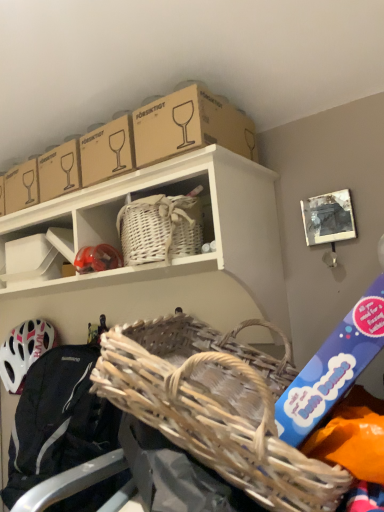
Image resolution: width=384 pixels, height=512 pixels. Describe the element at coordinates (58, 420) in the screenshot. I see `woven fabric basket at lower left` at that location.

Describe the element at coordinates (214, 408) in the screenshot. I see `woven natural picnic basket at center` at that location.

What is the approximate width of white matte helmet at lower left?

The width of white matte helmet at lower left is 16.85 centimeters.

Identify the location of white plastic tray at lower left. (38, 252).

Find the location of a particular element. Image resolution: width=384 pixels, height=512 pixels. woven fabric basket at lower left is located at coordinates (58, 420).

Consider the image. Which is closer, (199, 140) or (47, 346)?

Point (199, 140) is positioned closer to the camera compared to point (47, 346).

Who is more distant, brown cardboard box at upper center or white matte helmet at lower left?

white matte helmet at lower left is behind.

From the image's perspective, is brown cardboard box at upper center located beneath white matte helmet at lower left?

No, from the image's perspective, brown cardboard box at upper center is not beneath white matte helmet at lower left.

Which is more to the left, white matte helmet at lower left or white plastic tray at lower left?

white matte helmet at lower left.

Can you confirm if white matte helmet at lower left is bigger than white plastic tray at lower left?

Indeed, white matte helmet at lower left has a larger size compared to white plastic tray at lower left.

Is white matte helmet at lower left behind white plastic tray at lower left?

Yes, the depth of white matte helmet at lower left is greater than that of white plastic tray at lower left.

Is point (8, 386) less distant than point (16, 268)?

No, (8, 386) is further to viewer.

Does woven fabric basket at lower left appear on the left side of white wicker basket at upper center?

No, woven fabric basket at lower left is not to the left of white wicker basket at upper center.

The height and width of the screenshot is (512, 384). In order to click on clothing located below the white wicker basket at upper center (from the image's perspective) in this screenshot , I will do `click(58, 420)`.

Is woven fabric basket at lower left next to white wicker basket at upper center and touching it?

No.

Which is behind, point (57, 350) or point (51, 269)?

Point (57, 350)

Is matte red helmet at center at the right side of white matte helmet at lower left?

Yes.

Image resolution: width=384 pixels, height=512 pixels. What are the coordinates of `helmet that appears behind the matte red helmet at center` in the screenshot? It's located at (24, 351).

How many degrees apart are the facing directions of matte red helmet at center and white matte helmet at lower left?

matte red helmet at center and white matte helmet at lower left are facing 1.58 degrees away from each other.

The width and height of the screenshot is (384, 512). Identify the location of storage box located above the white matte helmet at lower left (from a real-world perspective). (190, 126).

Who is taller, white matte helmet at lower left or brown cardboard box at upper center?

white matte helmet at lower left is taller.

From a real-world perspective, which object rests below the other?

white matte helmet at lower left, from a real-world perspective.

From the image's perspective, is white matte helmet at lower left below brown cardboard box at upper center?

Yes.

Which of these two, brown cardboard box at upper center or woven natural picnic basket at center, is bigger?

With larger size is woven natural picnic basket at center.

Does brown cardboard box at upper center have a greater height compared to woven natural picnic basket at center?

No, brown cardboard box at upper center is not taller than woven natural picnic basket at center.

Is woven natural picnic basket at center completely or partially inside brown cardboard box at upper center?

No, woven natural picnic basket at center is not surrounded by brown cardboard box at upper center.

Would you say matte red helmet at center is to the left or to the right of white plastic tray at lower left in the picture?

From the image, it's evident that matte red helmet at center is to the right of white plastic tray at lower left.

Is point (95, 266) closer to camera compared to point (34, 241)?

Yes, point (95, 266) is closer to viewer.

You are a GUI agent. You are given a task and a screenshot of the screen. Output one action in this format:
    pyautogui.click(x=<x>, y=<y>)
    Task: Click on the helmet below the brown cardboard box at upper center (from the image's perspective)
    The width and height of the screenshot is (384, 512).
    Given the screenshot: What is the action you would take?
    pyautogui.click(x=24, y=351)

What are the coordinates of `shelf in front of the white matte helmet at lower left` in the screenshot? It's located at (38, 252).

When comparing their distances from white matte helmet at lower left, does white plastic tray at lower left or matte red helmet at center seem further?

The object further to white matte helmet at lower left is matte red helmet at center.

Looking at the image, which one is located closer to white plastic tray at lower left, white wicker basket at upper center or woven natural picnic basket at center?

white wicker basket at upper center lies closer to white plastic tray at lower left than the other object.

When comparing their distances from brown cardboard box at upper center, does white matte helmet at lower left or white wicker basket at upper center seem further?

white matte helmet at lower left is further to brown cardboard box at upper center.

Considering their positions, is brown cardboard box at upper center positioned closer to white matte helmet at lower left than white wicker basket at upper center?

white wicker basket at upper center.

Which object lies nearer to the anchor point white wicker basket at upper center, white plastic tray at lower left or woven natural picnic basket at center?

white plastic tray at lower left.

From the image, which object appears to be farther from white matte helmet at lower left, woven natural picnic basket at center or brown cardboard box at upper center?

brown cardboard box at upper center is positioned further to the anchor white matte helmet at lower left.

Considering their positions, is white plastic tray at lower left positioned further to white matte helmet at lower left than woven natural picnic basket at center?

woven natural picnic basket at center is further to white matte helmet at lower left.

Which object lies nearer to the anchor point woven fabric basket at lower left, white plastic tray at lower left or white wicker basket at upper center?

white plastic tray at lower left is closer to woven fabric basket at lower left.

This screenshot has height=512, width=384. I want to click on bicycle helmet between white wicker basket at upper center and white plastic tray at lower left along the z-axis, so click(x=97, y=259).

This screenshot has height=512, width=384. Find the location of `shelf situated between white matte helmet at lower left and brown cardboard box at upper center from left to right`. shelf situated between white matte helmet at lower left and brown cardboard box at upper center from left to right is located at coordinates (38, 252).

Where is `bicycle helmet between white wicker basket at upper center and woven fabric basket at lower left in the vertical direction`? The width and height of the screenshot is (384, 512). bicycle helmet between white wicker basket at upper center and woven fabric basket at lower left in the vertical direction is located at coordinates (97, 259).

This screenshot has width=384, height=512. What are the coordinates of `storage box between woven natural picnic basket at center and white plastic tray at lower left from front to back` in the screenshot? It's located at (190, 126).